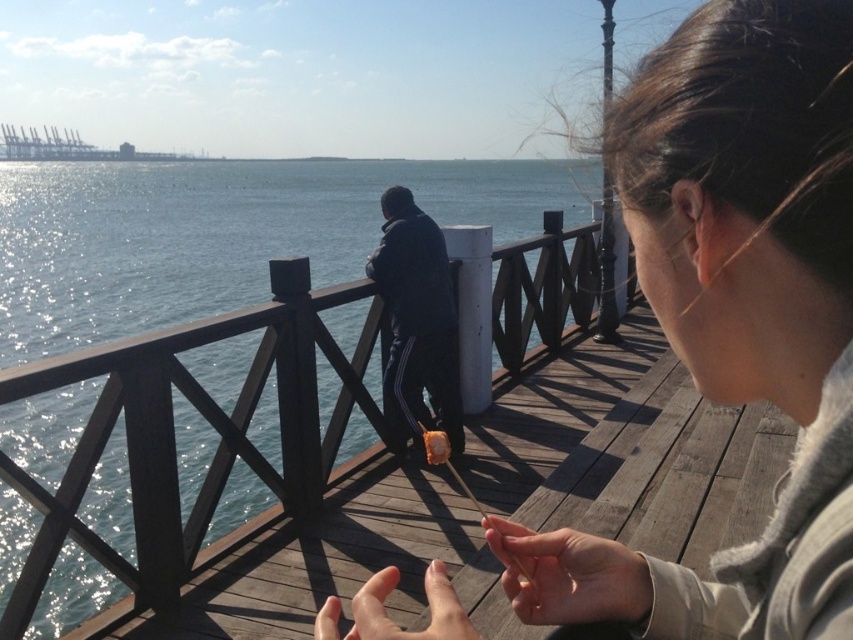
Question: Can you confirm if dark blue fabric jacket at center is smaller than smooth beige hand at lower right?

Choices:
 (A) yes
 (B) no

Answer: (B)

Question: Is smooth beige sweater at center above smooth skin hand at center?

Choices:
 (A) no
 (B) yes

Answer: (B)

Question: Which point is farther from the camera taking this photo?

Choices:
 (A) (640, 579)
 (B) (454, 598)
 (C) (787, 173)

Answer: (A)

Question: Is smooth beige sweater at center closer to camera compared to smooth skin hand at center?

Choices:
 (A) no
 (B) yes

Answer: (B)

Question: Based on their relative distances, which object is nearer to the smooth skin hand at center?

Choices:
 (A) smooth beige sweater at center
 (B) glistening blue water at center

Answer: (A)

Question: Which point is closer to the camera?

Choices:
 (A) (160, 310)
 (B) (527, 605)
 (C) (404, 419)

Answer: (B)